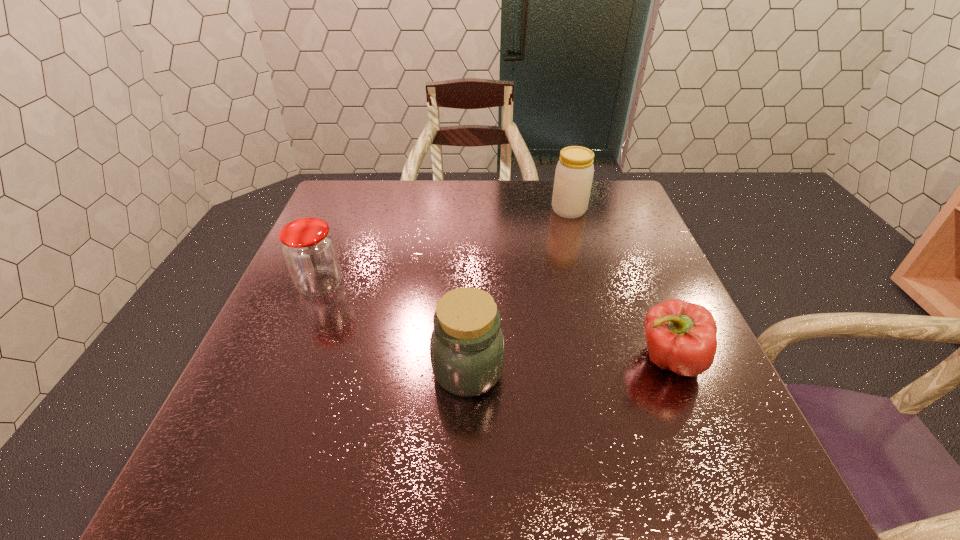
In order to click on vacant point located between the shortest object and the second jar from left to right in this screenshot , I will do `click(568, 365)`.

Identify which object is the second nearest to the third nearest object. Please provide its 2D coordinates. Your answer should be formatted as a tuple, i.e. [(x, y)], where the tuple contains the x and y coordinates of a point satisfying the conditions above.

[(574, 172)]

Locate which object is the second closest to the nearest jar. Please provide its 2D coordinates. Your answer should be formatted as a tuple, i.e. [(x, y)], where the tuple contains the x and y coordinates of a point satisfying the conditions above.

[(309, 250)]

You are a GUI agent. You are given a task and a screenshot of the screen. Output one action in this format:
    pyautogui.click(x=<x>, y=<y>)
    Task: Click on the second closest jar to the shortest object
    
    Given the screenshot: What is the action you would take?
    pyautogui.click(x=574, y=172)

Identify which jar is located as the nearest to the shortest object. Please provide its 2D coordinates. Your answer should be formatted as a tuple, i.e. [(x, y)], where the tuple contains the x and y coordinates of a point satisfying the conditions above.

[(467, 348)]

Where is `free location that satisfies the following two spatial constraints: 1. on the front side of the farthest object; 2. on the left side of the shortest object`? This screenshot has height=540, width=960. free location that satisfies the following two spatial constraints: 1. on the front side of the farthest object; 2. on the left side of the shortest object is located at coordinates (611, 360).

I want to click on free space that satisfies the following two spatial constraints: 1. on the front side of the shortest object; 2. on the left side of the second nearest jar, so click(290, 360).

Locate an element on the screen. The height and width of the screenshot is (540, 960). free space that satisfies the following two spatial constraints: 1. on the back side of the nearest jar; 2. on the right side of the shortest object is located at coordinates (468, 360).

This screenshot has height=540, width=960. Find the location of `free space that satisfies the following two spatial constraints: 1. on the front side of the second farthest jar; 2. on the left side of the second jar from left to right`. free space that satisfies the following two spatial constraints: 1. on the front side of the second farthest jar; 2. on the left side of the second jar from left to right is located at coordinates (286, 370).